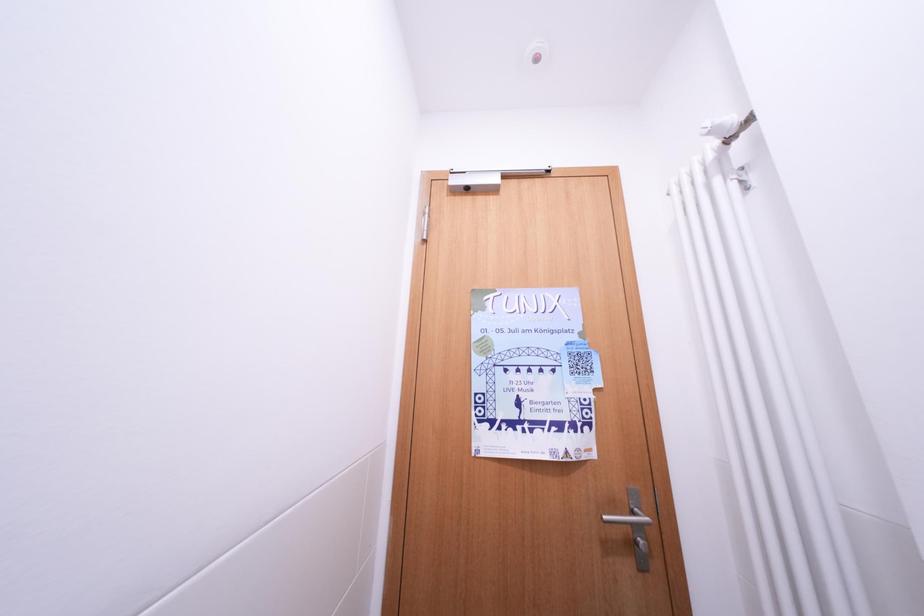
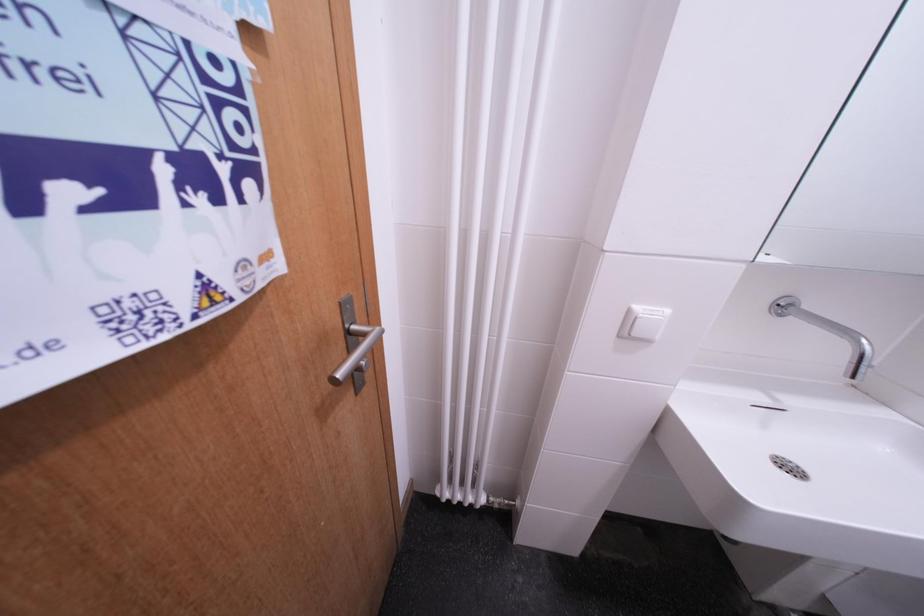
First-person continuous shooting, in which direction is the camera rotating?

The rotation direction of the camera is right-down.